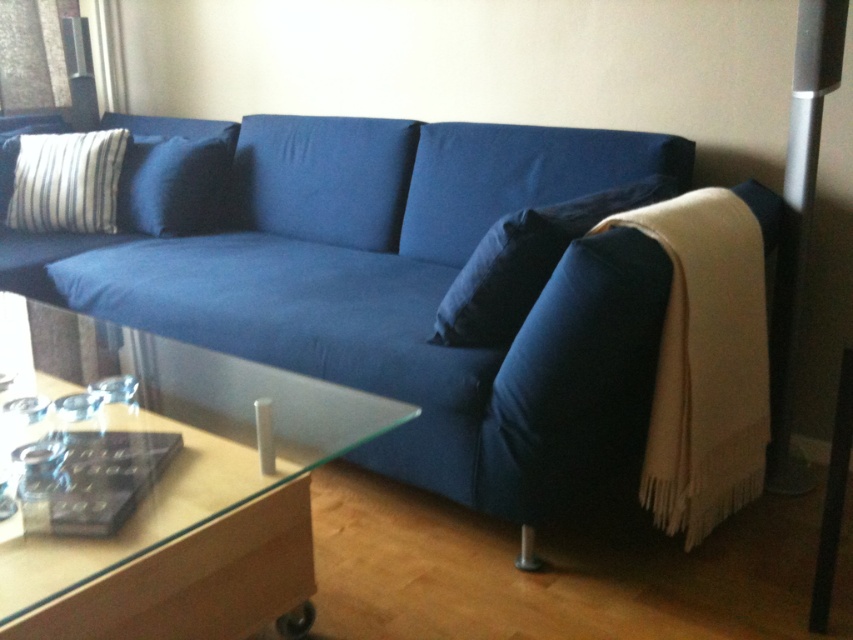
Is transparent glass side table at lower left thinner than striped fabric pillow at upper left?

No.

Can you confirm if transparent glass side table at lower left is bigger than striped fabric pillow at upper left?

Correct, transparent glass side table at lower left is larger in size than striped fabric pillow at upper left.

Who is more distant from viewer, (x=154, y=552) or (x=59, y=177)?

The point (x=59, y=177) is more distant.

Where is `transparent glass side table at lower left`? Image resolution: width=853 pixels, height=640 pixels. transparent glass side table at lower left is located at coordinates (183, 500).

Which of these two, dark blue fabric pillow at center or blue fabric pillow at upper left, stands shorter?

Standing shorter between the two is dark blue fabric pillow at center.

Between dark blue fabric pillow at center and blue fabric pillow at upper left, which one is positioned higher?

Positioned higher is blue fabric pillow at upper left.

Which is in front, point (525, 310) or point (136, 200)?

Positioned in front is point (525, 310).

Locate an element on the screen. This screenshot has height=640, width=853. dark blue fabric pillow at center is located at coordinates (525, 262).

Is clear plastic pad at lower left further to the viewer compared to blue fabric pillow at upper left?

No, clear plastic pad at lower left is in front of blue fabric pillow at upper left.

Where is `clear plastic pad at lower left`? The image size is (853, 640). clear plastic pad at lower left is located at coordinates (94, 481).

This screenshot has height=640, width=853. Describe the element at coordinates (94, 481) in the screenshot. I see `clear plastic pad at lower left` at that location.

At what (x,y) coordinates should I click in order to perform the action: click on clear plastic pad at lower left. Please return your answer as a coordinate pair (x, y). Image resolution: width=853 pixels, height=640 pixels. Looking at the image, I should click on (94, 481).